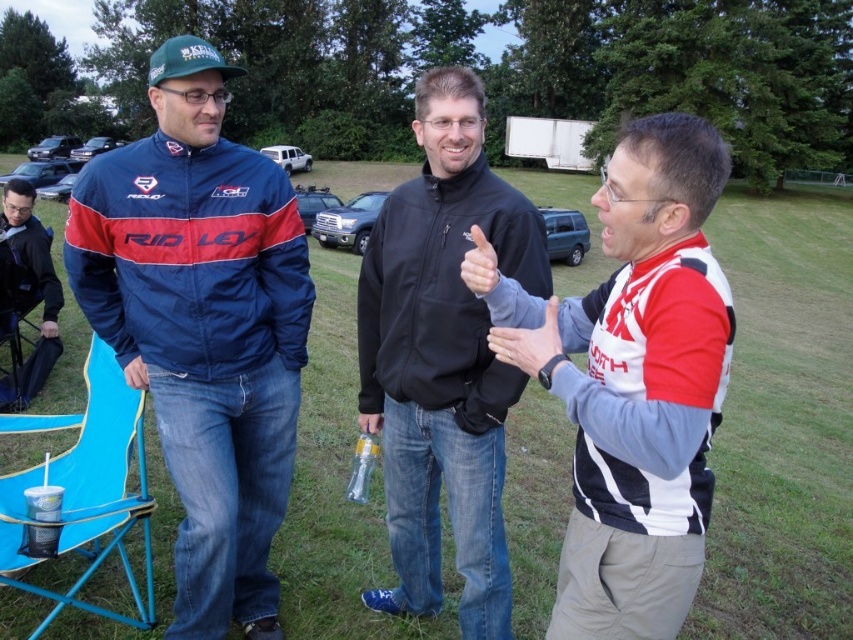
You are sitting on the black fabric chair at lower left and want to reach the blue plastic folding chair at lower left. Can you step down to it directly?

The blue plastic folding chair at lower left is below the black fabric chair at lower left, so yes, you can step down to it directly.

You are a guest at this outdoor event and notice the matte blue jacket at left and the black fabric chair at lower left. Which item is covering the other?

The matte blue jacket at left is positioned over the black fabric chair at lower left, so the jacket is covering the chair.

You are part of a team organizing a sports event and need to ensure all team jerseys are properly positioned. The white and black jersey at right is part of your team. Based on the scene, where should you place the other team members to maintain a balanced formation?

The white and black jersey at right is located at point (631,381). To maintain a balanced formation, position other team members symmetrically around this coordinate, ensuring equal spacing and alignment with the field layout.